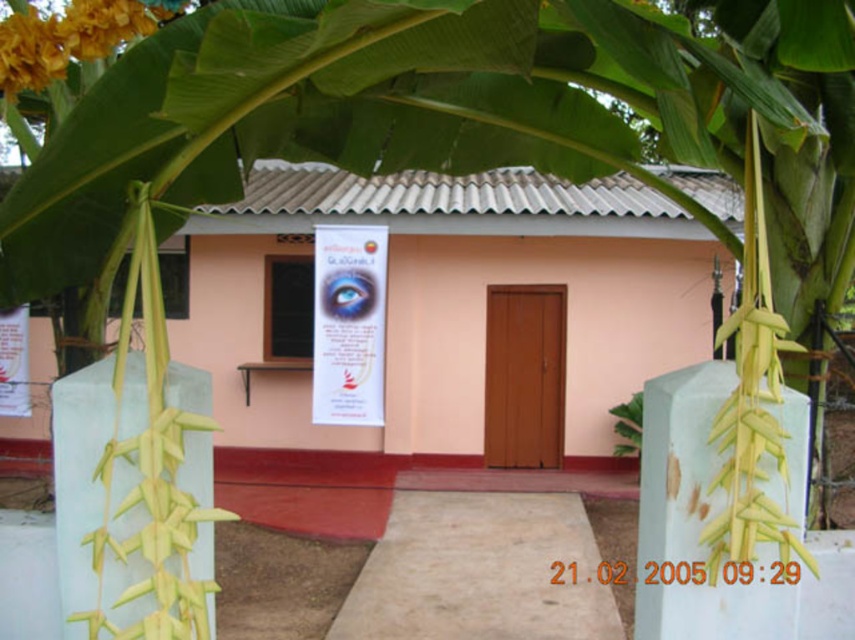
You are standing at the entrance of the building and looking towards the upper left corner of the image. What is the exact 2D coordinate of the yellow papery flower at upper left?

The yellow papery flower at upper left is located at the 2D coordinate point of (68, 38).

You are standing at the entrance of the building and looking towards the yellow papery flower at upper left and the green leafy plant at center. Which one is taller?

The green leafy plant at center is taller than the yellow papery flower at upper left.

In the scene shown: You are standing in front of the building and want to place a small decoration between the yellow papery flower at upper left and the green leafy plant at center. Which object should you place it closer to if you want it to be near the front?

You should place the decoration closer to the yellow papery flower at upper left because it is closer to the viewer than the green leafy plant at center.